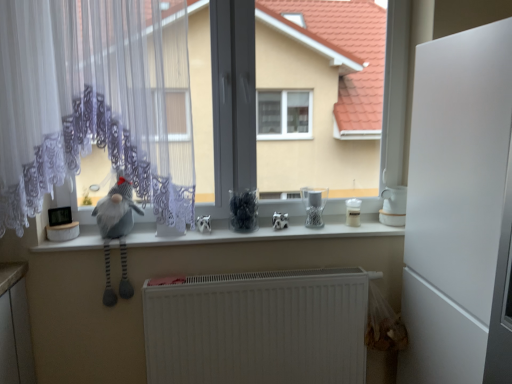
Find the location of a particular element. This screenshot has height=384, width=512. vacant space that is to the left of white plastic container at center, which is the 2th appliance from right to left is located at coordinates (334, 226).